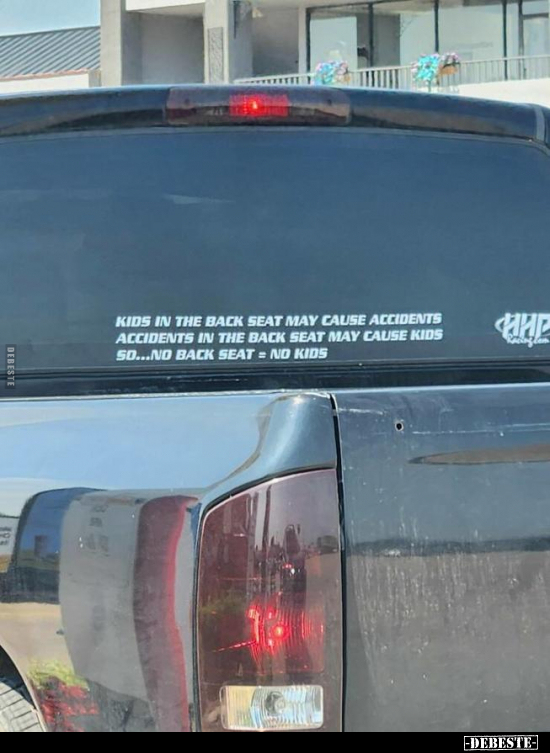
Identify the location of bed light. (264, 104).